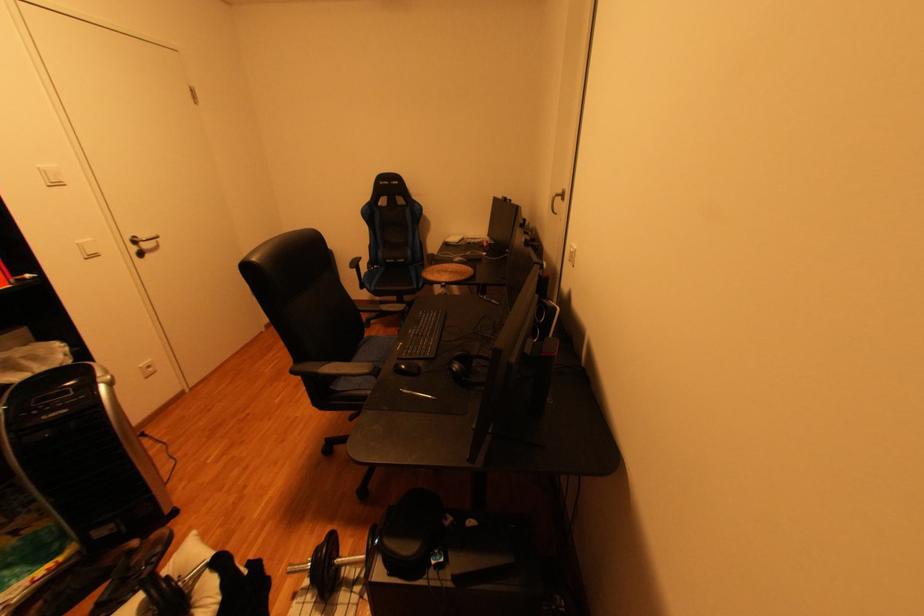
The location [407,367] corresponds to which object?

This point indicates the black computer mouse.